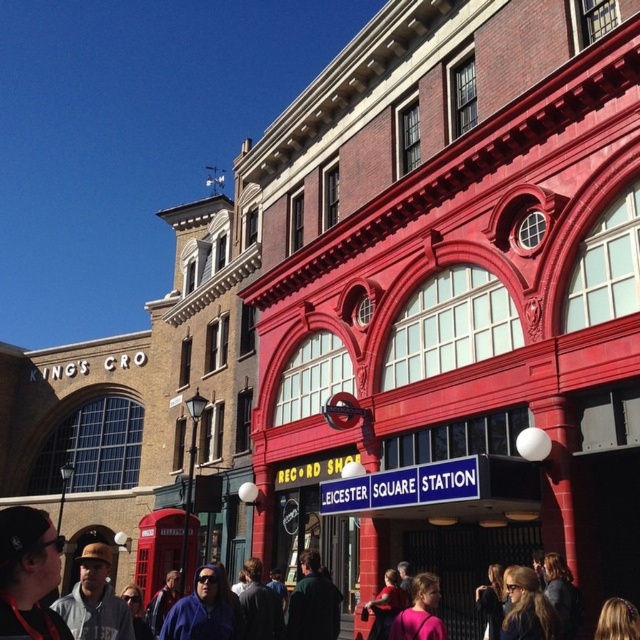
Question: Does dark clothing crowd at lower center appear under gray hoodie at lower left?

Choices:
 (A) yes
 (B) no

Answer: (B)

Question: Which point is farther to the camera?

Choices:
 (A) (90, 541)
 (B) (32, 554)
 (C) (26, 509)

Answer: (A)

Question: Which point is closer to the camera?

Choices:
 (A) gray hoodie at lower left
 (B) dark clothing crowd at lower center

Answer: (B)

Question: Which point is closer to the camera?

Choices:
 (A) (58, 609)
 (B) (6, 614)
 (C) (44, 536)

Answer: (B)

Question: Does matte black cap at lower left have a larger size compared to gray hoodie at lower left?

Choices:
 (A) yes
 (B) no

Answer: (B)

Question: Can you confirm if matte black cap at lower left is thinner than gray hoodie at lower left?

Choices:
 (A) no
 (B) yes

Answer: (B)